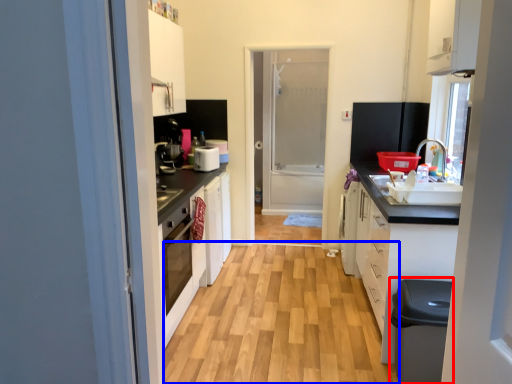
Question: Among these objects, which one is farthest to the camera, dish washer (highlighted by a red box) or plain (highlighted by a blue box)?

Choices:
 (A) dish washer
 (B) plain

Answer: (B)